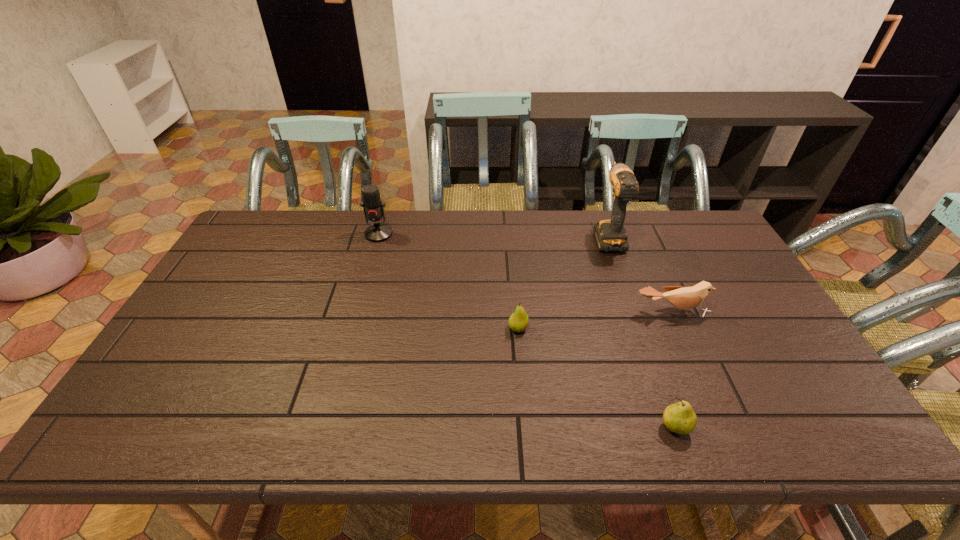
The width and height of the screenshot is (960, 540). In order to click on vacant area situated on the right of the left pear in this screenshot , I will do `click(641, 328)`.

The width and height of the screenshot is (960, 540). What are the coordinates of `vacant space located on the right of the right pear` in the screenshot? It's located at (797, 428).

Identify the location of drill present at the far edge. (610, 235).

You are a GUI agent. You are given a task and a screenshot of the screen. Output one action in this format:
    pyautogui.click(x=<x>, y=<y>)
    Task: Click on the microphone at the far edge
    
    Given the screenshot: What is the action you would take?
    pyautogui.click(x=373, y=207)

Locate an element on the screen. The image size is (960, 540). object that is at the near edge is located at coordinates (680, 418).

Where is `free location at the far edge of the desktop`? The width and height of the screenshot is (960, 540). free location at the far edge of the desktop is located at coordinates (336, 227).

Find the location of a particular element. The height and width of the screenshot is (540, 960). free space at the near edge is located at coordinates (673, 433).

Locate an element on the screen. This screenshot has width=960, height=540. vacant area at the right edge of the desktop is located at coordinates (739, 327).

Find the location of a particular element. vacant space at the far left corner of the desktop is located at coordinates (266, 245).

Where is `vacant region at the near left corner of the desktop`? The width and height of the screenshot is (960, 540). vacant region at the near left corner of the desktop is located at coordinates (141, 431).